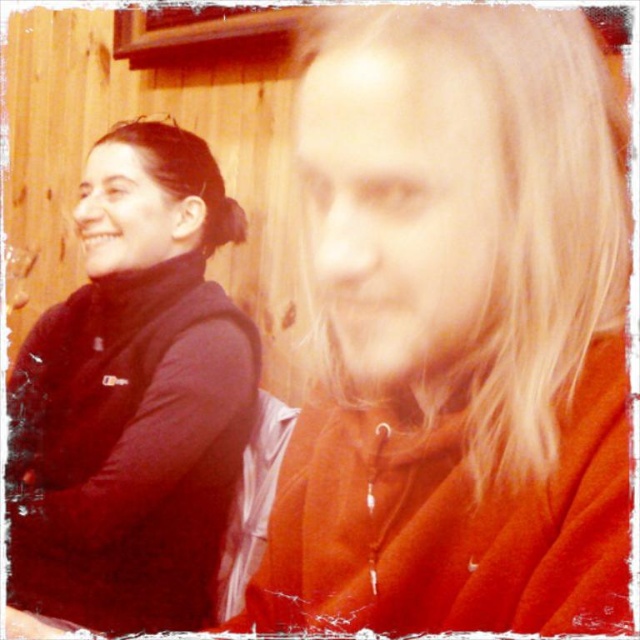
Question: Can you confirm if orange fleece jacket at center is positioned below black fleece at left?

Choices:
 (A) yes
 (B) no

Answer: (A)

Question: Which point is farther from the camera taking this photo?

Choices:
 (A) (598, 516)
 (B) (184, 148)

Answer: (B)

Question: Which point appears closest to the camera in this image?

Choices:
 (A) (193, 268)
 (B) (541, 502)

Answer: (B)

Question: Is orange fleece jacket at center closer to camera compared to black fleece at left?

Choices:
 (A) yes
 (B) no

Answer: (A)

Question: Where is orange fleece jacket at center located in relation to black fleece at left in the image?

Choices:
 (A) left
 (B) right

Answer: (B)